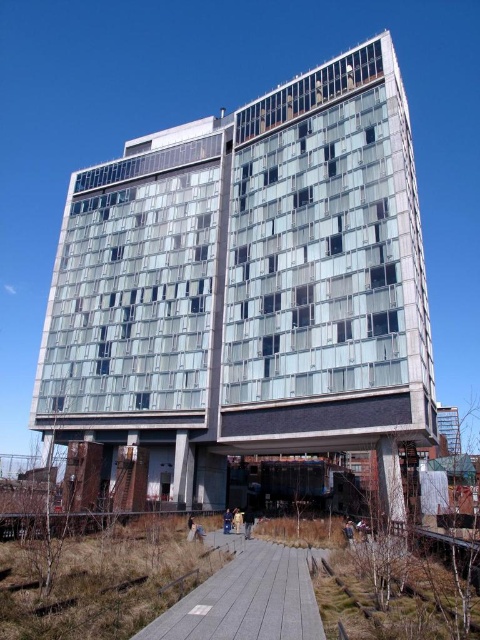
Question: Does glassy concrete building at center appear on the left side of gray concrete path at center?

Choices:
 (A) no
 (B) yes

Answer: (B)

Question: Which object appears closest to the camera in this image?

Choices:
 (A) gray concrete path at center
 (B) glassy concrete building at center

Answer: (A)

Question: Is glassy concrete building at center positioned behind gray concrete path at center?

Choices:
 (A) yes
 (B) no

Answer: (A)

Question: Can you confirm if glassy concrete building at center is positioned above gray concrete path at center?

Choices:
 (A) no
 (B) yes

Answer: (B)

Question: Which point is closer to the camera?

Choices:
 (A) (170, 211)
 (B) (308, 625)

Answer: (B)